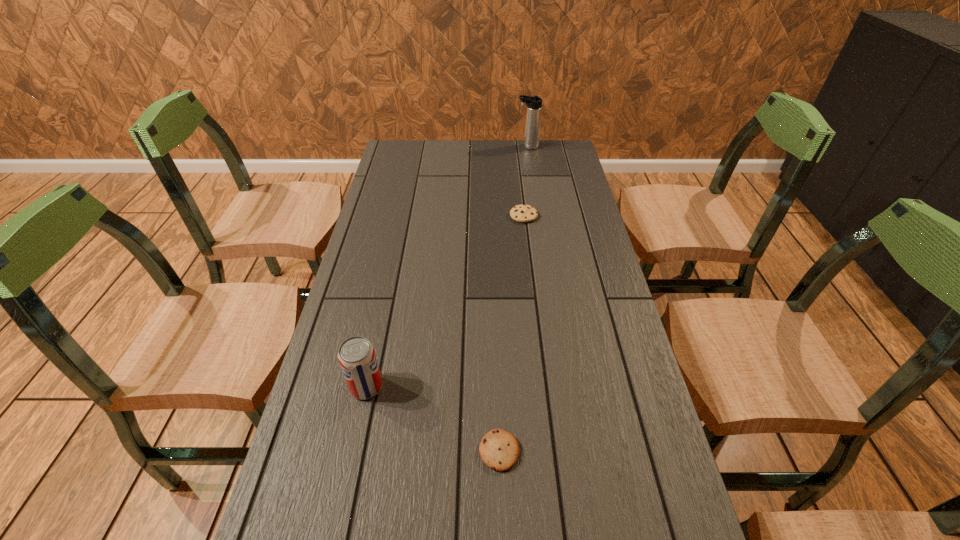
Identify the location of vacant area that lies between the tallest object and the left cookie. (514, 299).

Identify which object is the nearest to the second farthest object. Please provide its 2D coordinates. Your answer should be formatted as a tuple, i.e. [(x, y)], where the tuple contains the x and y coordinates of a point satisfying the conditions above.

[(534, 104)]

Identify which object is the third closest to the second farthest object. Please provide its 2D coordinates. Your answer should be formatted as a tuple, i.e. [(x, y)], where the tuple contains the x and y coordinates of a point satisfying the conditions above.

[(499, 450)]

Where is `vacant region that satisfies the following two spatial constraints: 1. on the handle side of the farthest object; 2. on the front side of the leftmost object`? vacant region that satisfies the following two spatial constraints: 1. on the handle side of the farthest object; 2. on the front side of the leftmost object is located at coordinates (566, 387).